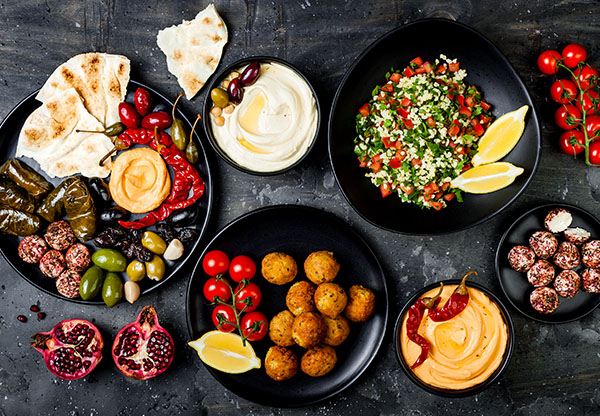
Identify the location of black scratched table. (91, 40).